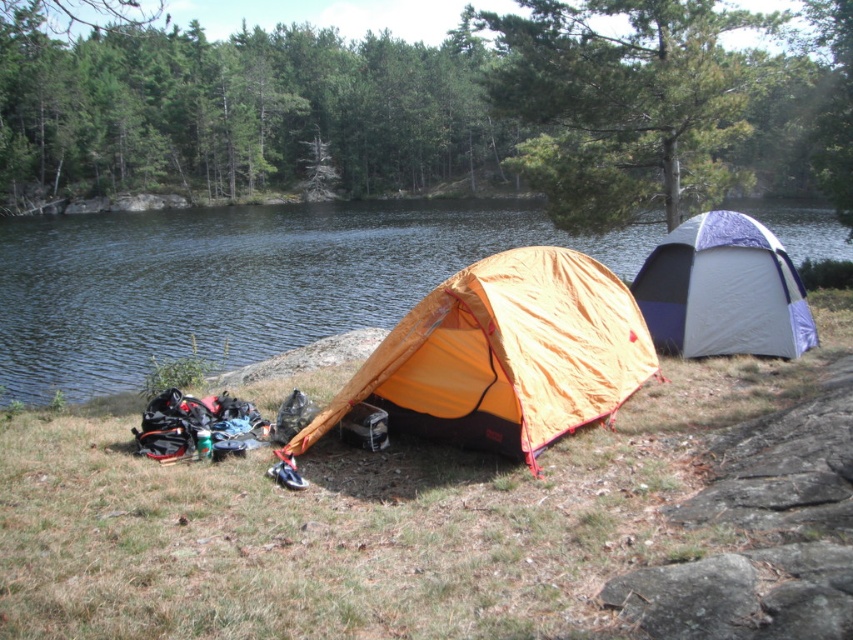
You are a hiker planning to set up a small campfire between the two points labeled point (622, 378) and point (752, 289). Which point should you place the firewood closer to in order to have it positioned in front of the other point?

You should place the firewood closer to point (622, 378) because it is in front of point (752, 289).

You are a hiker planning to set up a tent in this camping area. You have two options based on the image provided. Which tent, the orange nylon tent at center or the white and purple fabric tent at right, would you choose if you need more space for your gear?

The orange nylon tent at center is bigger than the white and purple fabric tent at right, so you should choose the orange nylon tent at center for more space.

You are a hiker planning to set up a tent in the camping area shown. You see the transparent blue water at center and the orange nylon tent at center. Which object is positioned higher in the image?

The transparent blue water at center is located above the orange nylon tent at center, so it is higher in the image.